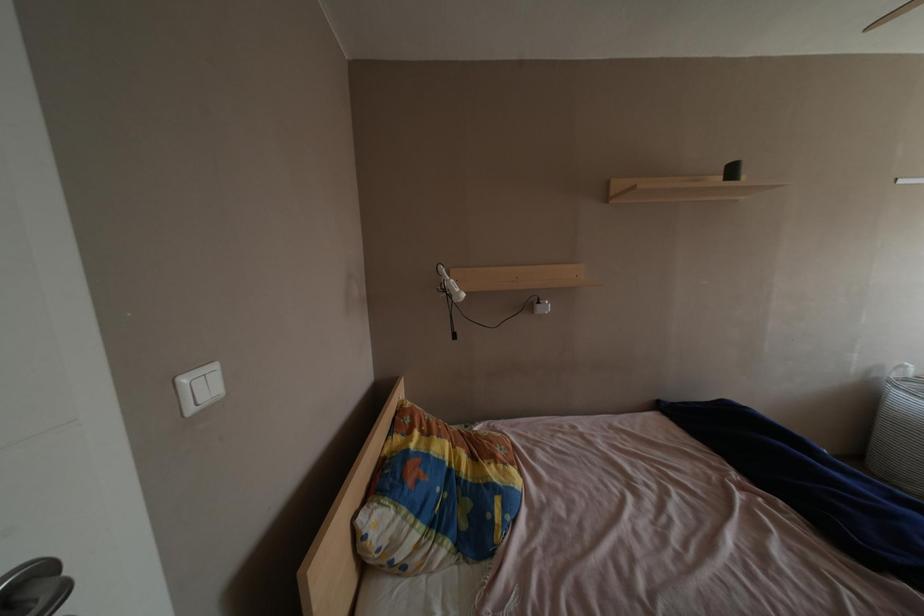
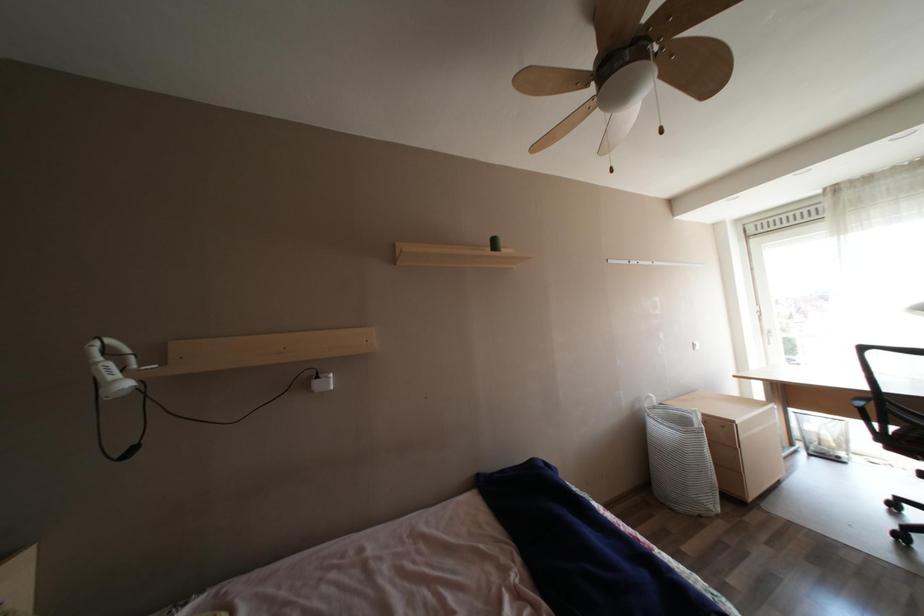
Question: Which direction would the cameraman need to move to produce the second image? Reply with the corresponding letter.

Choices:
 (A) Left
 (B) Right
 (C) Forward
 (D) Backward

Answer: (B)